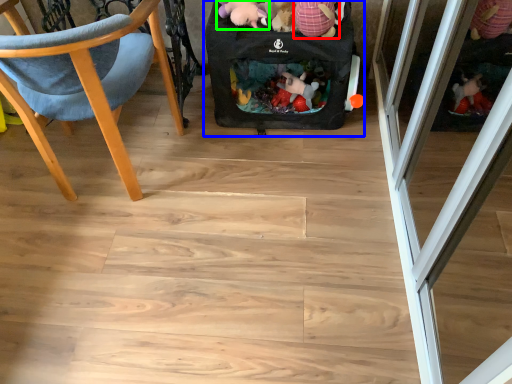
Question: Which object is the farthest from toy (highlighted by a red box)? Choose among these: baby carriage (highlighted by a blue box) or toy (highlighted by a green box).

Choices:
 (A) baby carriage
 (B) toy

Answer: (A)